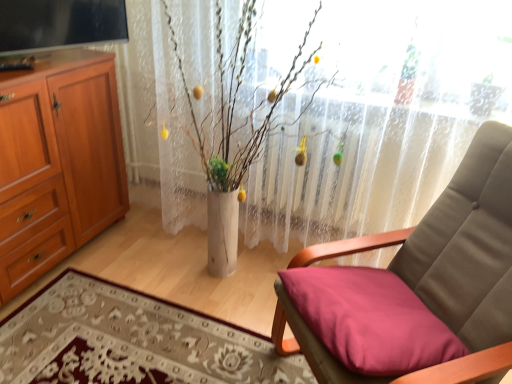
Question: Is white sheer curtain at center thinner than wooden cabinet at left?

Choices:
 (A) no
 (B) yes

Answer: (B)

Question: From the image's perspective, is white sheer curtain at center located beneath wooden cabinet at left?

Choices:
 (A) no
 (B) yes

Answer: (A)

Question: Does white sheer curtain at center have a larger size compared to wooden cabinet at left?

Choices:
 (A) no
 (B) yes

Answer: (B)

Question: From the image's perspective, does white sheer curtain at center appear higher than wooden cabinet at left?

Choices:
 (A) no
 (B) yes

Answer: (B)

Question: Is white sheer curtain at center shorter than wooden cabinet at left?

Choices:
 (A) yes
 (B) no

Answer: (B)

Question: From a real-world perspective, is white sheer curtain at center positioned above or below smooth fabric cushion at lower right?

Choices:
 (A) below
 (B) above

Answer: (B)

Question: Considering the positions of white sheer curtain at center and smooth fabric cushion at lower right in the image, is white sheer curtain at center wider or thinner than smooth fabric cushion at lower right?

Choices:
 (A) wide
 (B) thin

Answer: (B)

Question: Based on their sizes in the image, would you say white sheer curtain at center is bigger or smaller than smooth fabric cushion at lower right?

Choices:
 (A) big
 (B) small

Answer: (A)

Question: Is white sheer curtain at center inside or outside of smooth fabric cushion at lower right?

Choices:
 (A) outside
 (B) inside

Answer: (A)

Question: From their relative heights in the image, would you say smooth fabric cushion at lower right is taller or shorter than white sheer curtain at center?

Choices:
 (A) tall
 (B) short

Answer: (B)

Question: From the image's perspective, relative to white sheer curtain at center, is smooth fabric cushion at lower right above or below?

Choices:
 (A) above
 (B) below

Answer: (B)

Question: From a real-world perspective, is smooth fabric cushion at lower right above or below white sheer curtain at center?

Choices:
 (A) below
 (B) above

Answer: (A)

Question: Based on their sizes in the image, would you say smooth fabric cushion at lower right is bigger or smaller than white sheer curtain at center?

Choices:
 (A) small
 (B) big

Answer: (A)

Question: Is smooth fabric cushion at lower right taller or shorter than matte beige cushion at center right?

Choices:
 (A) short
 (B) tall

Answer: (A)

Question: Is smooth fabric cushion at lower right bigger or smaller than matte beige cushion at center right?

Choices:
 (A) big
 (B) small

Answer: (B)